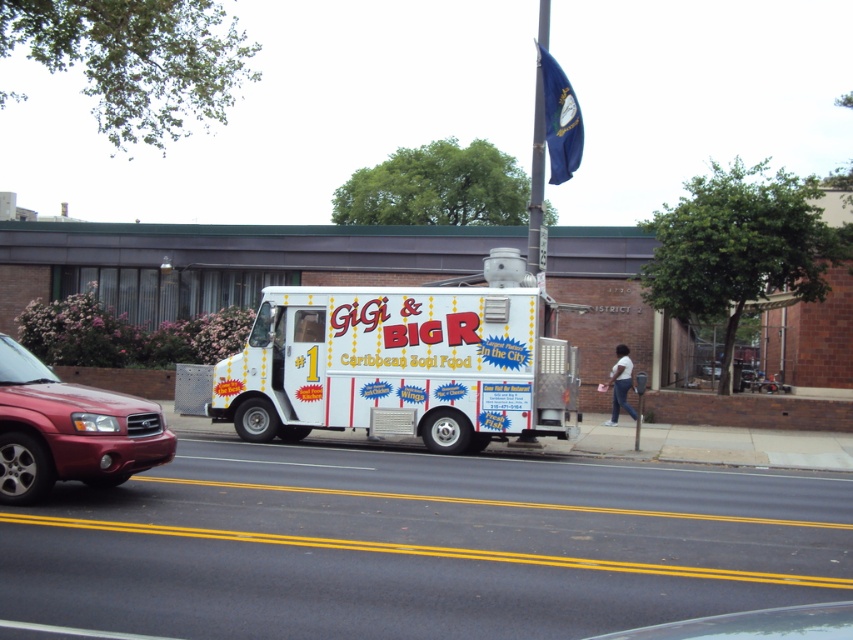
Question: Does metallic red suv at left appear under metallic pole at upper center?

Choices:
 (A) no
 (B) yes

Answer: (B)

Question: Is white glossy food truck at center to the right of metallic pole at upper center from the viewer's perspective?

Choices:
 (A) yes
 (B) no

Answer: (B)

Question: Which point appears farthest from the camera in this image?

Choices:
 (A) (134, 433)
 (B) (534, 202)
 (C) (222, 410)

Answer: (B)

Question: Can you confirm if white glossy food truck at center is positioned to the right of metallic red suv at left?

Choices:
 (A) yes
 (B) no

Answer: (A)

Question: Which object is positioned farthest from the metallic pole at upper center?

Choices:
 (A) metallic red suv at left
 (B) white glossy food truck at center

Answer: (A)

Question: Among these points, which one is farthest from the camera?

Choices:
 (A) (413, 289)
 (B) (154, 406)
 (C) (540, 182)

Answer: (C)